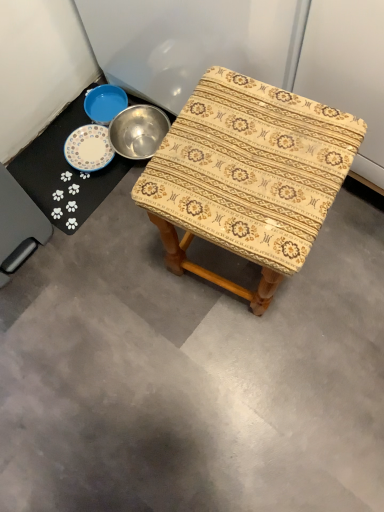
Image resolution: width=384 pixels, height=512 pixels. Find the location of `free region under white glossy plate at upper left (from a real-world perspective)`. free region under white glossy plate at upper left (from a real-world perspective) is located at coordinates (64, 170).